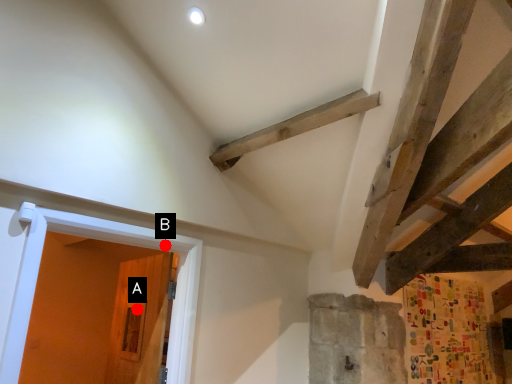
Question: Two points are circled on the image, labeled by A and B beside each circle. Which point appears farthest from the camera in this image?

Choices:
 (A) A is further
 (B) B is further

Answer: (A)